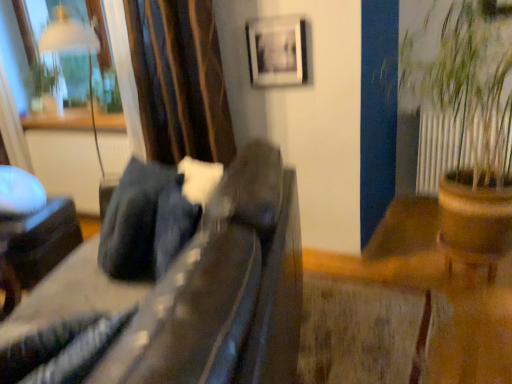
Question: Is velvet-like brown curtain at upper left in front of or behind brown wooden pot at right in the image?

Choices:
 (A) behind
 (B) front

Answer: (A)

Question: Considering the relative positions of velvet-like brown curtain at upper left and brown wooden pot at right in the image provided, is velvet-like brown curtain at upper left to the left or to the right of brown wooden pot at right?

Choices:
 (A) left
 (B) right

Answer: (A)

Question: Estimate the real-world distances between objects in this image. Which object is closer to the velvet-like brown curtain at upper left?

Choices:
 (A) brown wooden pot at right
 (B) black glossy side table at lower left, the second furniture from the front
 (C) suede-like dark brown couch at center, the 2th furniture positioned from the left
 (D) metallic silver frame at upper center
 (E) transparent glass window at upper left

Answer: (D)

Question: Estimate the real-world distances between objects in this image. Which object is farther from the brown wooden pot at right?

Choices:
 (A) transparent glass window at upper left
 (B) suede-like dark brown couch at center, which ranks as the second furniture in back-to-front order
 (C) metallic silver frame at upper center
 (D) velvet-like brown curtain at upper left
 (E) black glossy side table at lower left, the first furniture when ordered from left to right

Answer: (E)